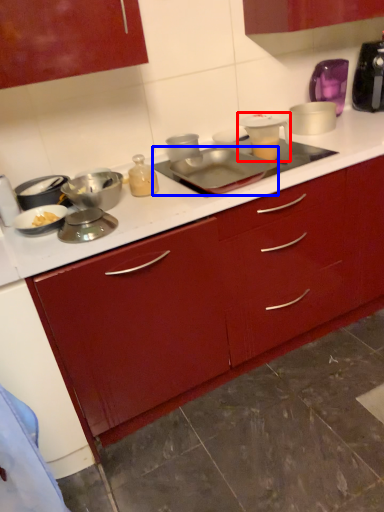
Question: Among these objects, which one is farthest to the camera, appliance (highlighted by a red box) or kitchen appliance (highlighted by a blue box)?

Choices:
 (A) appliance
 (B) kitchen appliance

Answer: (A)